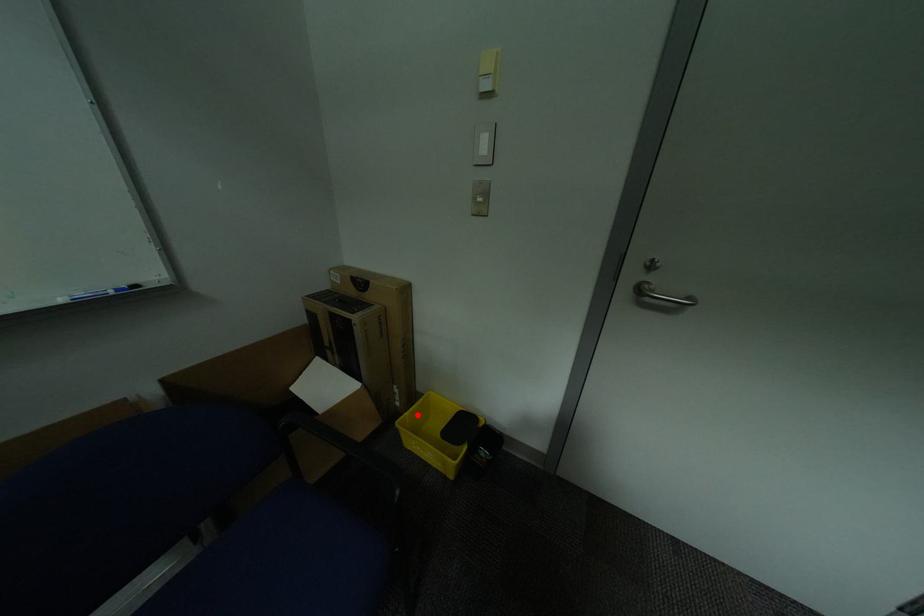
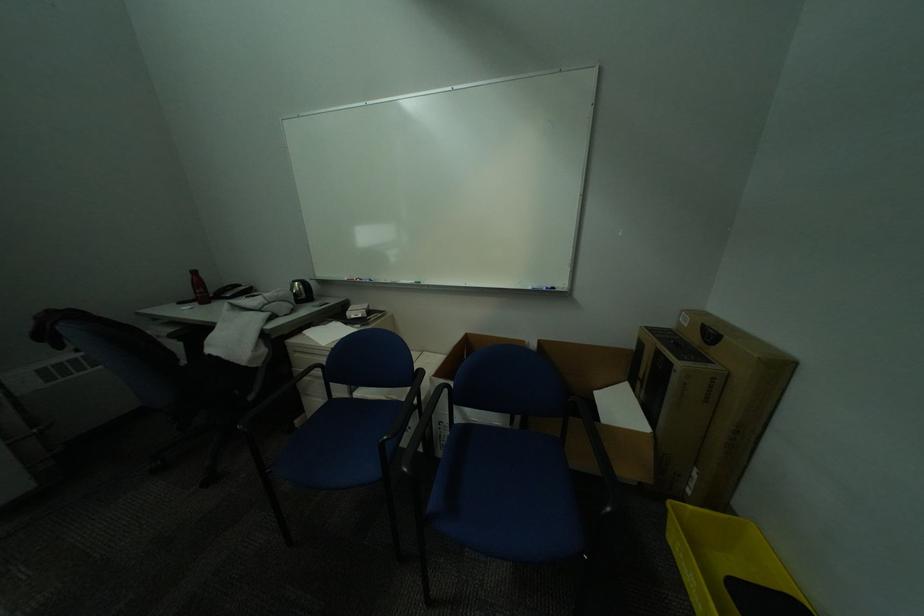
In the second image, find the point that corresponds to the highlighted location in the first image.

(701, 508)